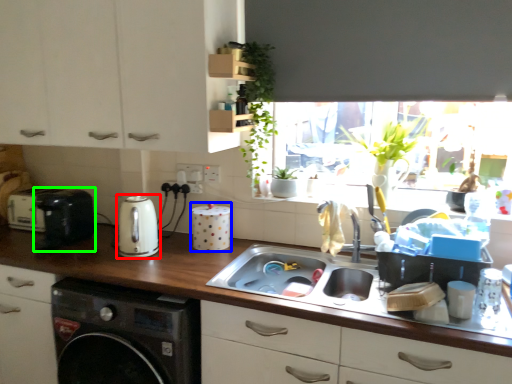
Question: Estimate the real-world distances between objects in this image. Which object is closer to kitchen appliance (highlighted by a red box), appliance (highlighted by a blue box) or appliance (highlighted by a green box)?

Choices:
 (A) appliance
 (B) appliance

Answer: (A)